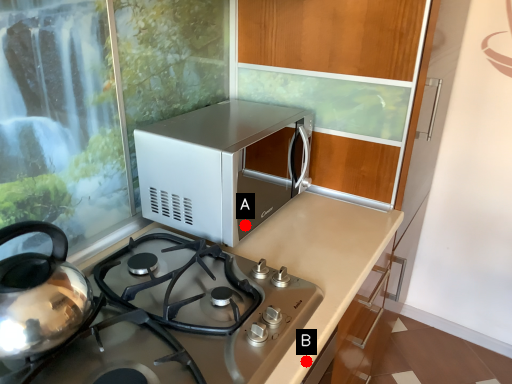
Question: Two points are circled on the image, labeled by A and B beside each circle. Which point appears closest to the camera in this image?

Choices:
 (A) A is closer
 (B) B is closer

Answer: (B)